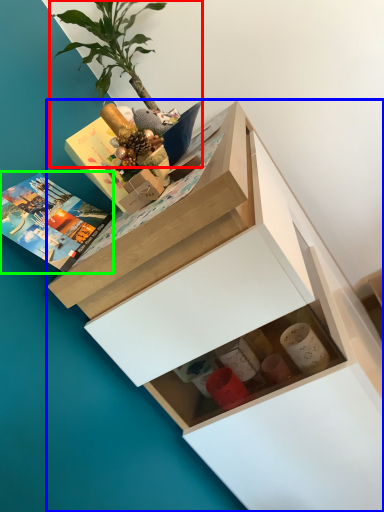
Question: Which object is the closest to the houseplant (highlighted by a red box)? Choose among these: chest of drawers (highlighted by a blue box) or book (highlighted by a green box).

Choices:
 (A) chest of drawers
 (B) book

Answer: (B)